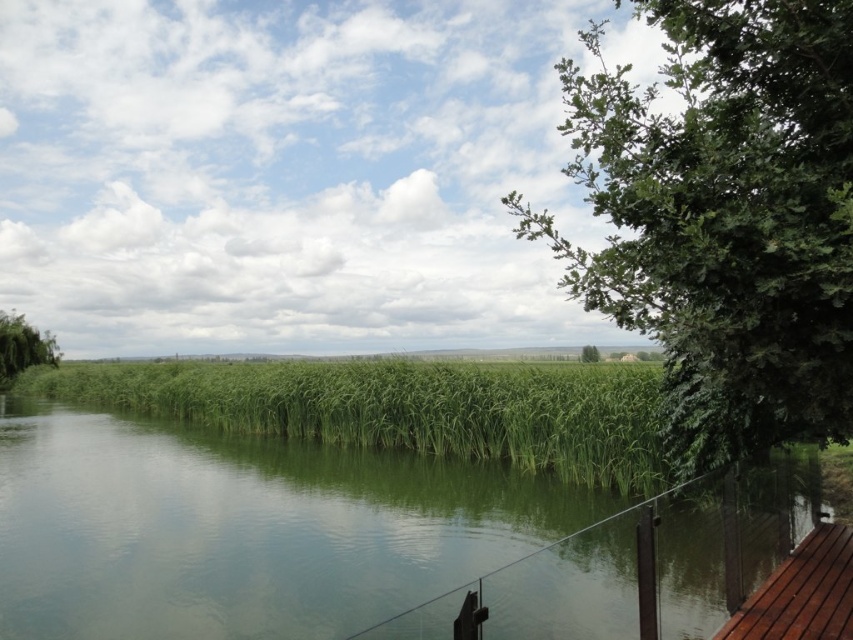
You are standing at the edge of the green grassy river at center and want to see the top of the green leafy tree at left. Can you see the top of the tree from your current position?

The green grassy river at center has a lesser height compared to green leafy tree at left, so yes, you can see the top of the green leafy tree at left from your current position because the tree is taller than the river.

In the scene shown: You are standing on the wooden deck and want to take a photo of the green leafy tree at left and the green grassy river at center. Which object should you frame first in your camera to ensure both are in the shot?

You should frame the green leafy tree at left first because it is positioned to the left of the green grassy river at center, so capturing it first ensures both are included in the photo.